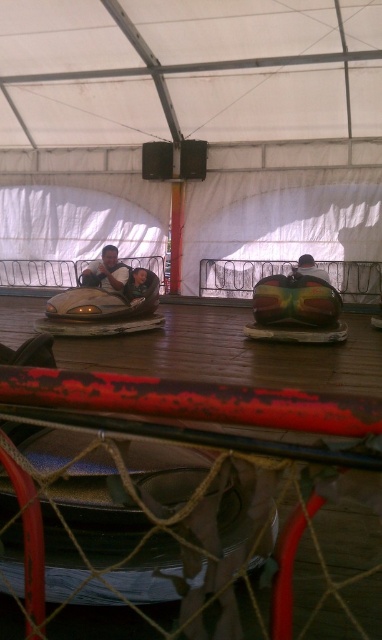
You are a safety inspector checking the helmets in the bumper car ride. You notice two helmets at the center of the ride. Which helmet is closer to you, the matte black helmet at center or the smooth plastic helmet at center?

The matte black helmet at center is closer to you because it is in front of the smooth plastic helmet at center.

You are a visitor at the amusement park and want to take a photo of the matte silver bumper car at center and the smooth plastic helmet at center. Which object should you focus on first if you want to capture both in one shot without moving the camera?

The matte silver bumper car at center is to the left of the smooth plastic helmet at center, so you should focus on the matte silver bumper car at center first to ensure both are in frame without moving the camera.